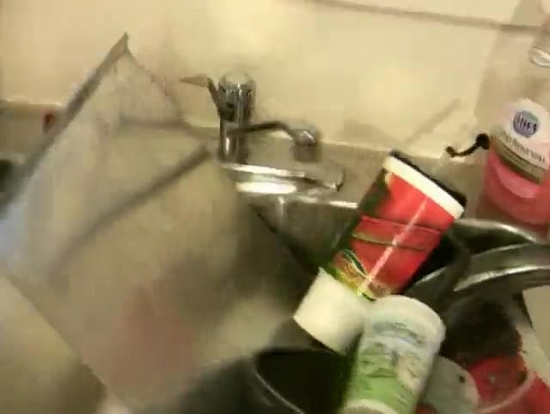
This screenshot has height=414, width=550. Find the location of `dish soap, pink liquid`. dish soap, pink liquid is located at coordinates (530, 210).